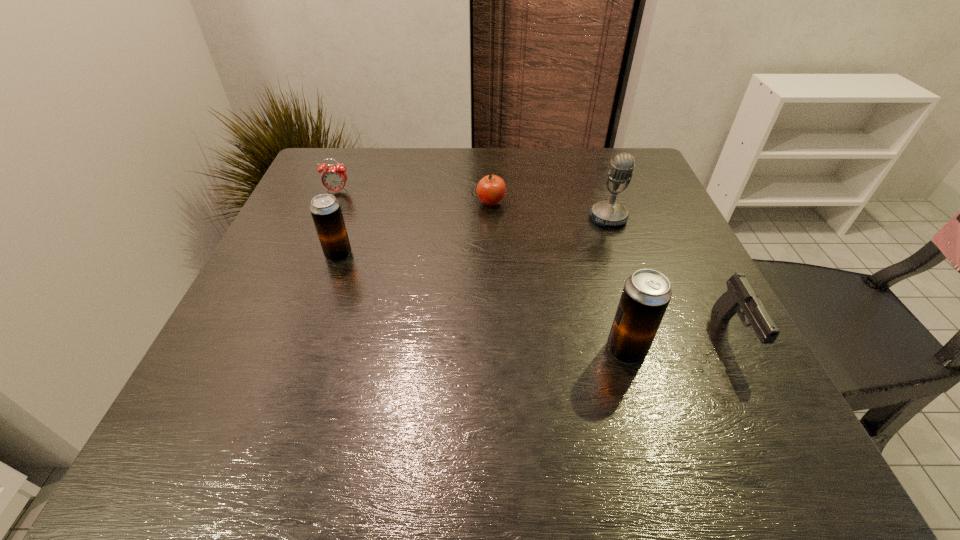
Where is `the fourth shortest object`? Image resolution: width=960 pixels, height=540 pixels. the fourth shortest object is located at coordinates (326, 212).

Identify the location of the left beer can. The image size is (960, 540). (326, 212).

Locate an element on the screen. The image size is (960, 540). the nearer beer can is located at coordinates (646, 294).

Where is `the right beer can`? This screenshot has width=960, height=540. the right beer can is located at coordinates (646, 294).

Where is `microphone`? This screenshot has width=960, height=540. microphone is located at coordinates (608, 212).

Where is `the third object from left to right`? the third object from left to right is located at coordinates (491, 190).

Where is `the farthest object`? the farthest object is located at coordinates (333, 178).

This screenshot has height=540, width=960. In order to click on the rightmost object in this screenshot , I will do `click(740, 295)`.

You are a GUI agent. You are given a task and a screenshot of the screen. Output one action in this format:
    pyautogui.click(x=<x>, y=<y>)
    Task: Click on the vacant space located on the right of the fourth shortest object
    
    Given the screenshot: What is the action you would take?
    pyautogui.click(x=427, y=254)

Locate an element on the screen. free region located 0.400m on the back of the right beer can is located at coordinates (584, 205).